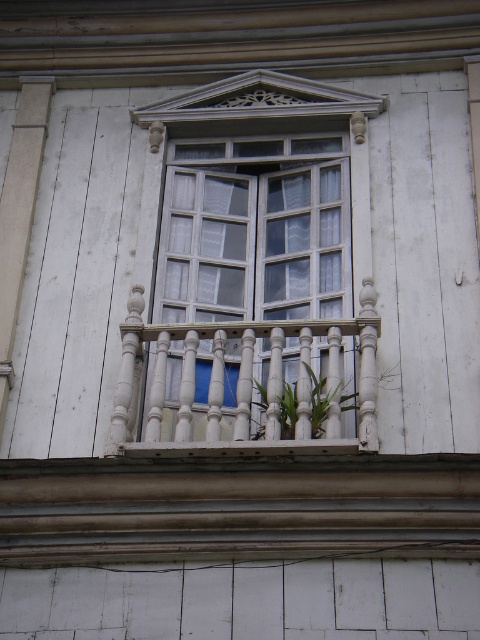
Can you confirm if white wooden balcony at center is bigger than green leafy plant at center?

Yes.

Does white wooden balcony at center have a lesser height compared to green leafy plant at center?

In fact, white wooden balcony at center may be taller than green leafy plant at center.

The image size is (480, 640). Describe the element at coordinates (240, 378) in the screenshot. I see `white wooden balcony at center` at that location.

The image size is (480, 640). Identify the location of white wooden balcony at center. (240, 378).

From the picture: How distant is clear glass window at center from green leafy plant at center?

clear glass window at center is 8.87 meters from green leafy plant at center.

Measure the distance between clear glass window at center and camera.

31.16 meters

Who is more distant from viewer, [173,355] or [292,429]?

The point [173,355] is more distant.

Identify the location of clear glass window at center. This screenshot has width=480, height=640. (254, 230).

Is clear glass window at center shorter than white wooden balcony at center?

No, clear glass window at center is not shorter than white wooden balcony at center.

The height and width of the screenshot is (640, 480). I want to click on clear glass window at center, so click(x=254, y=230).

Which is behind, point (171, 260) or point (113, 420)?

Positioned behind is point (171, 260).

Identify the location of clear glass window at center. (254, 230).